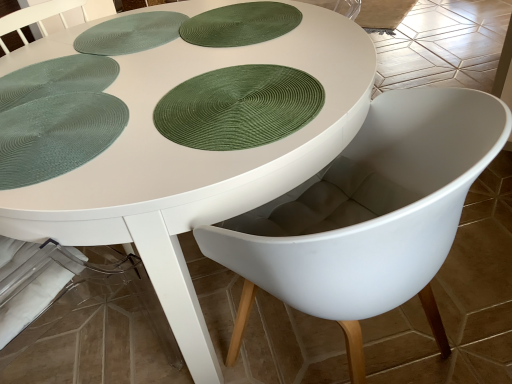
I want to click on vacant space in between green textured placemat at upper center, arranged as the 4th paper plate when ordered from the bottom, and green textured placemat at left, marked as the first paper plate in a bottom-to-top arrangement, so tap(164, 73).